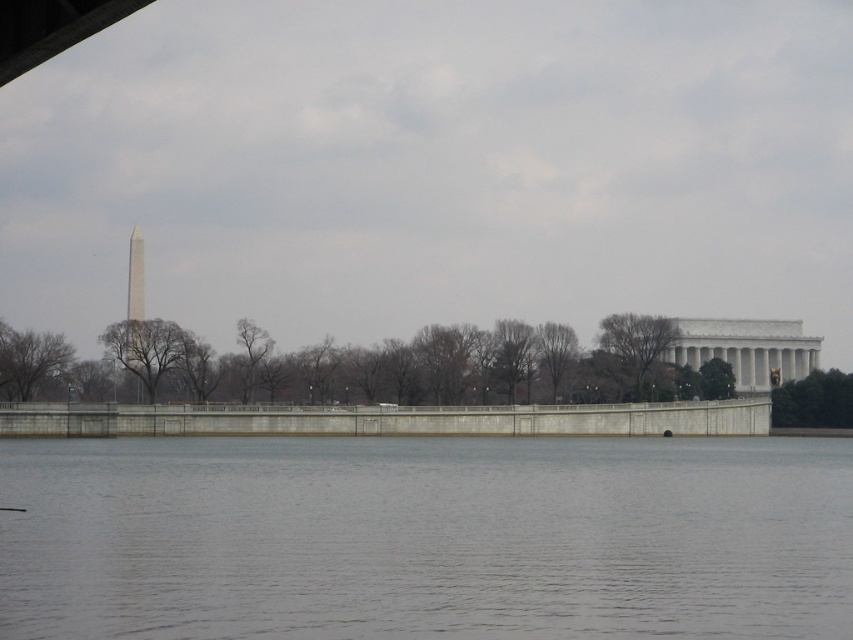
You are a photographer planning to capture a wide shot of the Lincoln Memorial and Washington Monument. You are standing on the concrete wall at center. Can you see the gray concrete river at center in your view? Explain why or why not based on their heights.

The gray concrete river at center is taller than the concrete wall at center. Since you are standing on the concrete wall at center, you can see the gray concrete river at center because it is higher in elevation.